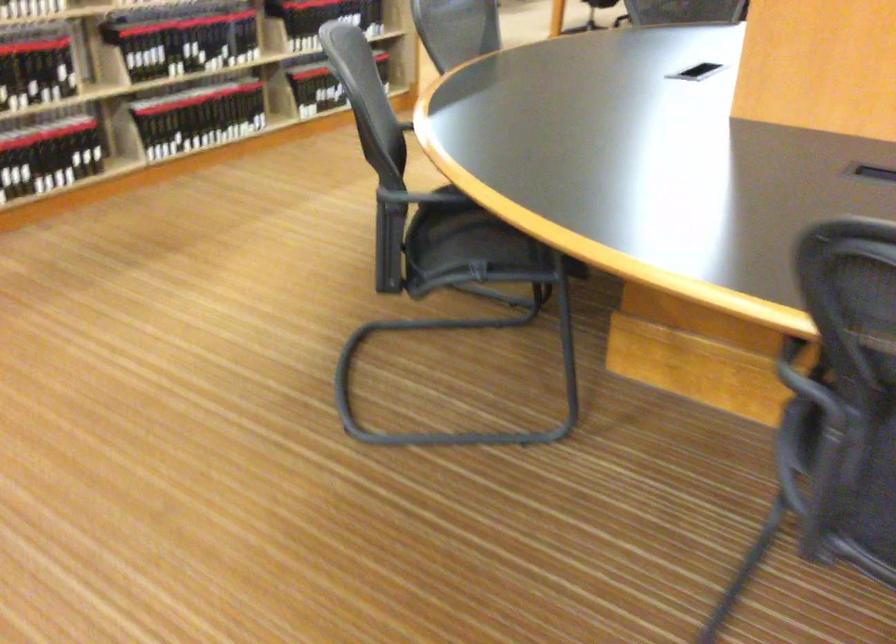
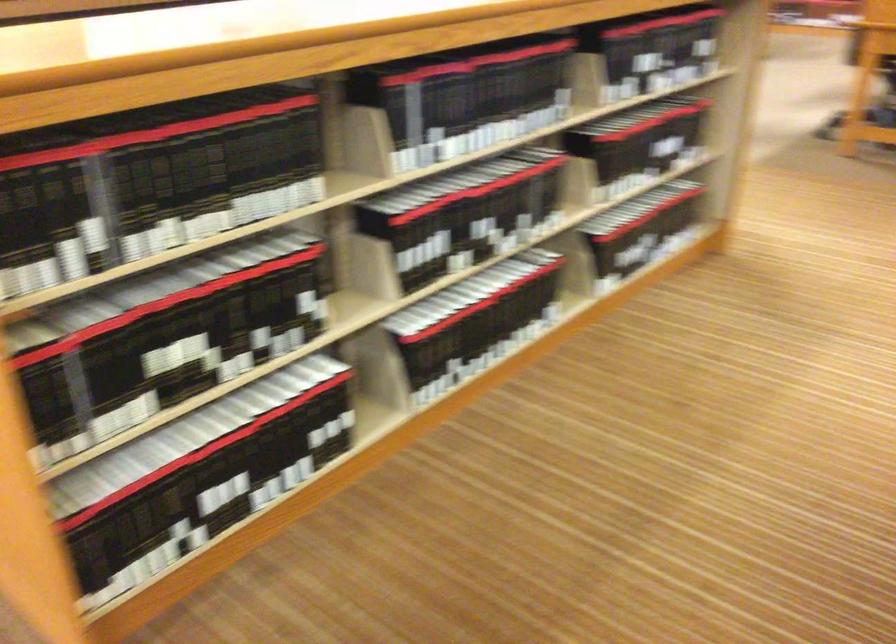
What movement of the cameraman would produce the second image?

The movement direction of the cameraman is left, forward.